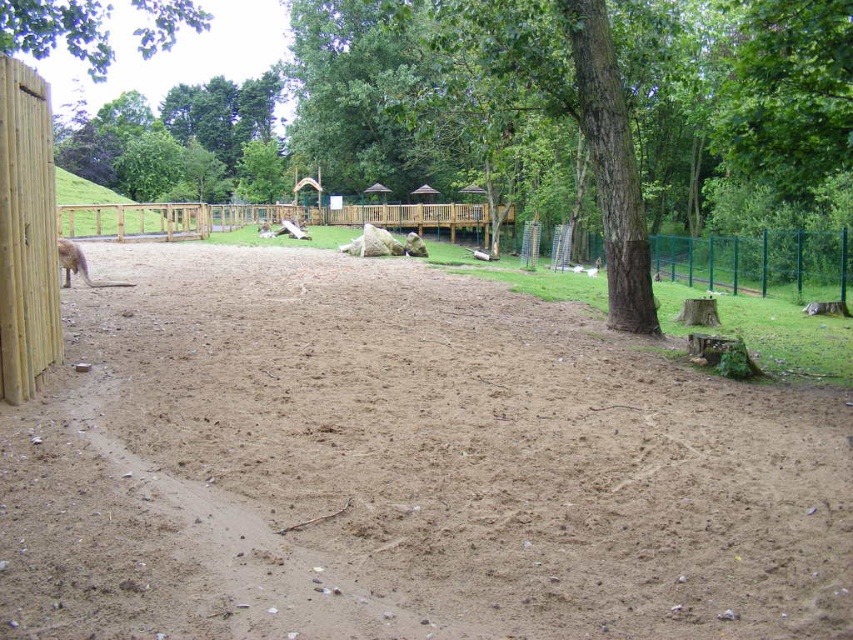
In the scene shown: Can you confirm if brown sandy dirt field at center is wider than green leafy tree at upper left?

No.

Can you confirm if brown sandy dirt field at center is positioned to the right of green leafy tree at upper left?

Yes, brown sandy dirt field at center is to the right of green leafy tree at upper left.

Measure the distance between brown sandy dirt field at center and camera.

brown sandy dirt field at center is 2.99 meters away from camera.

At what (x,y) coordinates should I click in order to perform the action: click on brown sandy dirt field at center. Please return your answer as a coordinate pair (x, y). This screenshot has width=853, height=640. Looking at the image, I should click on point(403,468).

Between brown sandy dirt field at center and brown furry kangaroo at left, which one has more height?

brown sandy dirt field at center is taller.

Is point (799, 444) positioned after point (86, 273)?

No, it is in front of (86, 273).

Image resolution: width=853 pixels, height=640 pixels. In order to click on brown sandy dirt field at center in this screenshot , I will do `click(403, 468)`.

Is green leafy tree at upper left smaller than brown furry kangaroo at left?

Actually, green leafy tree at upper left might be larger than brown furry kangaroo at left.

The image size is (853, 640). Describe the element at coordinates (57, 29) in the screenshot. I see `green leafy tree at upper left` at that location.

Is point (47, 3) in front of point (64, 269)?

Yes.

You are a GUI agent. You are given a task and a screenshot of the screen. Output one action in this format:
    pyautogui.click(x=<x>, y=<y>)
    Task: Click on the green leafy tree at upper left
    The height and width of the screenshot is (640, 853).
    Given the screenshot: What is the action you would take?
    pyautogui.click(x=57, y=29)